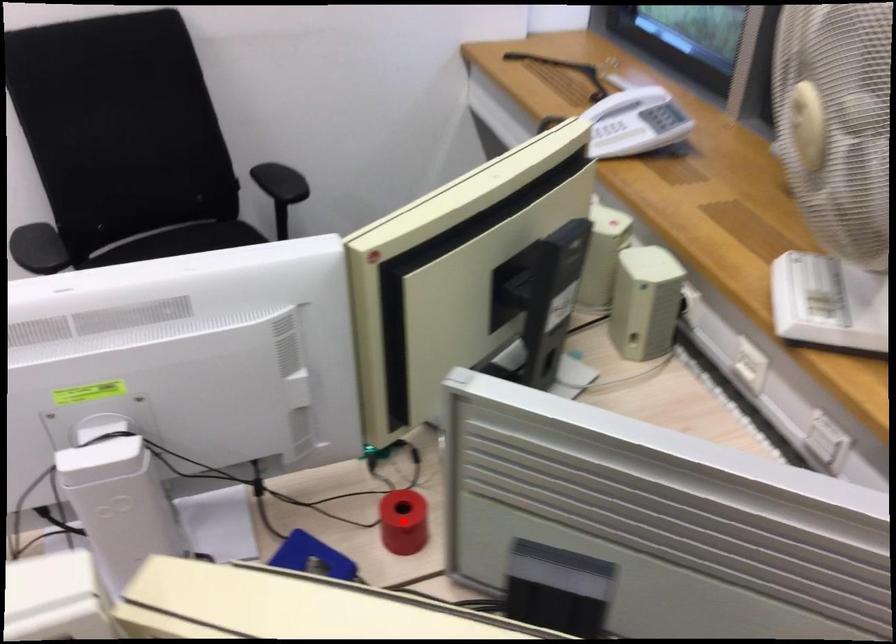
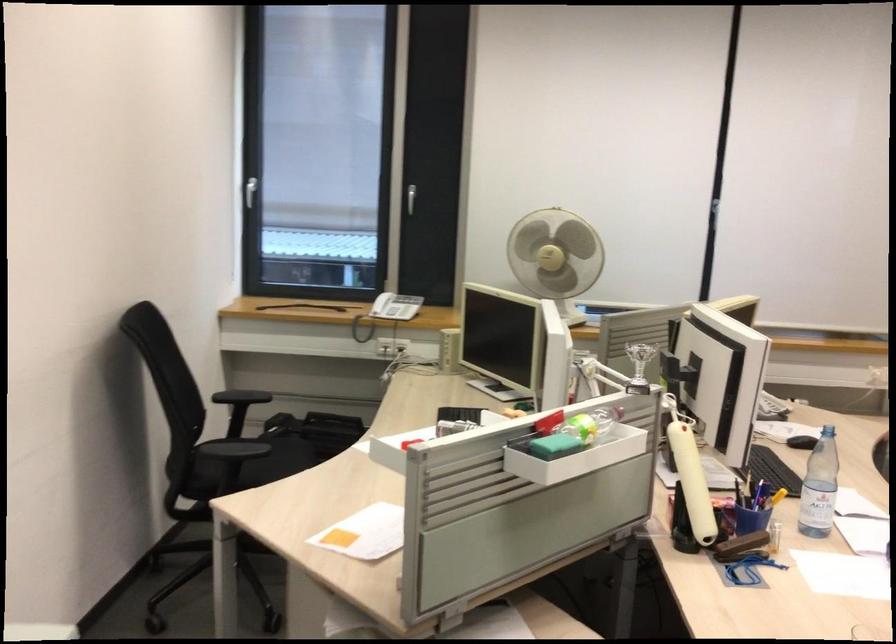
Question: I am providing you with two images of the same scene from different viewpoints. A red point is marked on the first image. Can you still see the location of the red point in image 2?

Choices:
 (A) Yes
 (B) No

Answer: (B)